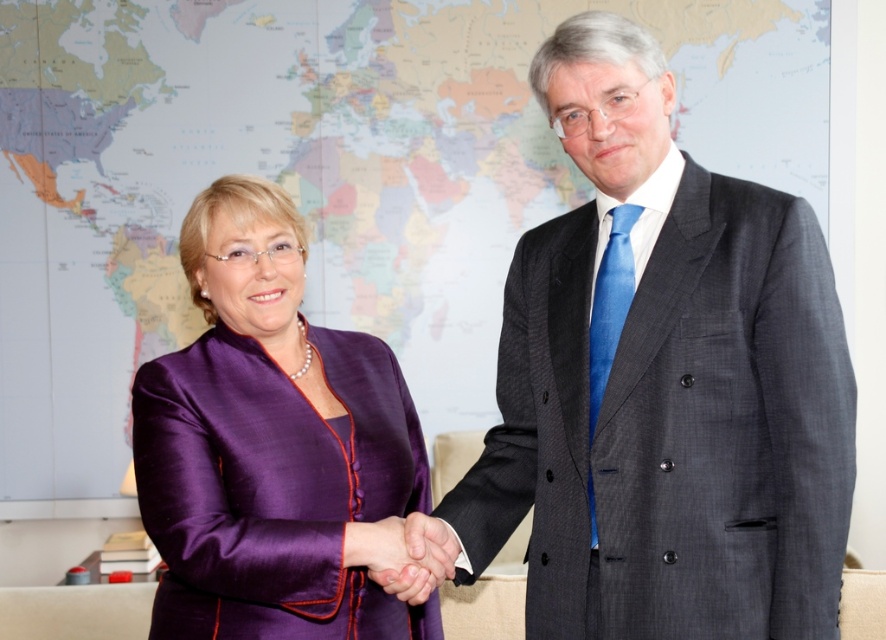
Is point (440, 104) closer to viewer compared to point (239, 522)?

No, (440, 104) is behind (239, 522).

Is the position of matte paper map at center more distant than that of purple silk dress at left?

Yes, it is behind purple silk dress at left.

Who is more distant from viewer, (445, 388) or (156, 422)?

Point (445, 388)

Locate an element on the screen. matte paper map at center is located at coordinates (323, 179).

Does matte paper map at center appear on the left side of dark gray suit at center?

Yes, matte paper map at center is to the left of dark gray suit at center.

Between point (165, 152) and point (618, 413), which one is positioned in front?

Point (618, 413)

Identify the location of matte paper map at center. (323, 179).

Can you confirm if matte paper map at center is shorter than purple silk hand at center?

No, matte paper map at center is not shorter than purple silk hand at center.

Can you confirm if matte paper map at center is bigger than purple silk hand at center?

Yes.

Does point (471, 77) come farther from viewer compared to point (424, 563)?

Yes, point (471, 77) is farther from viewer.

Find the location of a particular element. The height and width of the screenshot is (640, 886). matte paper map at center is located at coordinates (323, 179).